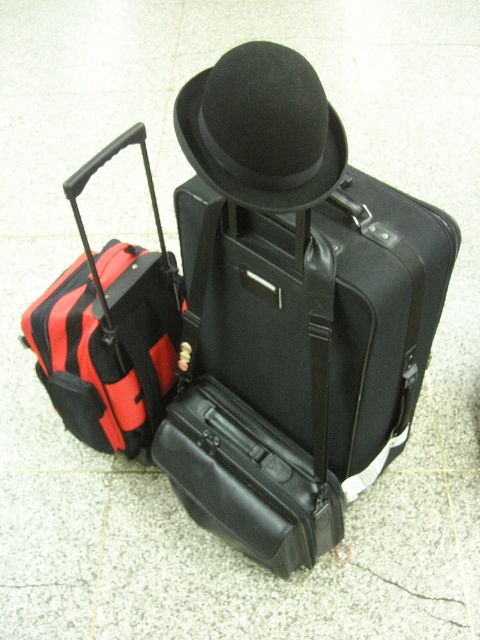
You are standing 30 inches away from the camera. Can you reach the black leather suitcase at center without moving?

The black leather suitcase at center is 32.95 inches away from the camera. Since you are standing 30 inches away from the camera, you are 2.95 inches too far to reach it without moving.

You are packing for a trip and need to choose between the black leather suitcase at center and the black felt fedora at center. Which one can hold more clothes?

The black leather suitcase at center has a larger size compared to the black felt fedora at center, so it can hold more clothes.